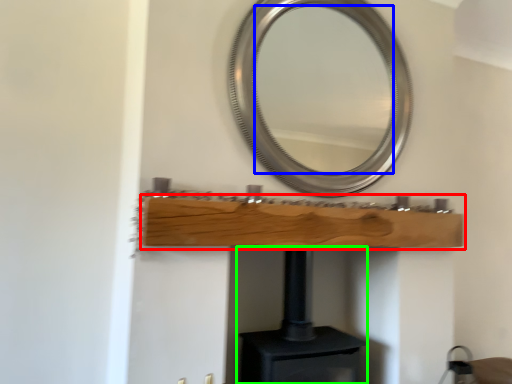
Question: Estimate the real-world distances between objects in this image. Which object is closer to shelf (highlighted by a red box), mirror (highlighted by a blue box) or fireplace (highlighted by a green box)?

Choices:
 (A) mirror
 (B) fireplace

Answer: (B)